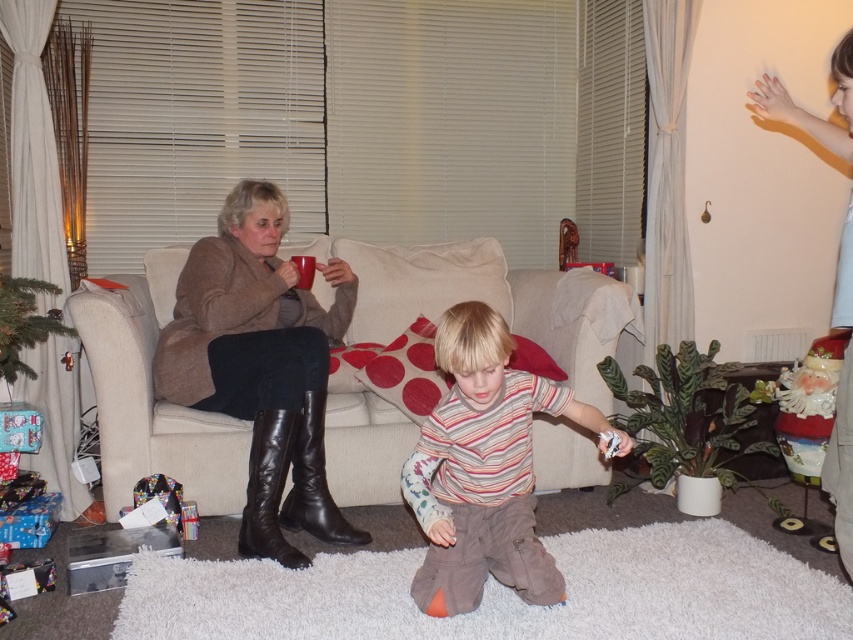
Does green matte plant at lower center come in front of black leather boot at lower left?

That is False.

Between point (717, 346) and point (288, 492), which one is positioned behind?

The point (717, 346) is behind.

Where is `green matte plant at lower center`? The image size is (853, 640). green matte plant at lower center is located at coordinates (685, 417).

How far apart are brown leather boots at left and striped cotton shirt at center?

brown leather boots at left and striped cotton shirt at center are 28.57 inches apart.

This screenshot has height=640, width=853. What do you see at coordinates (260, 365) in the screenshot?
I see `brown leather boots at left` at bounding box center [260, 365].

Is point (218, 324) closer to viewer compared to point (462, 301)?

No, it is not.

Image resolution: width=853 pixels, height=640 pixels. What are the coordinates of `brown leather boots at left` in the screenshot? It's located at (260, 365).

Can you confirm if brown leather boots at left is positioned above black leather boot at lower left?

Yes, brown leather boots at left is above black leather boot at lower left.

I want to click on brown leather boots at left, so click(260, 365).